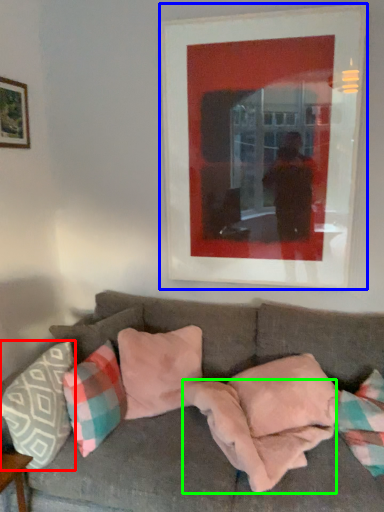
Question: Based on their relative distances, which object is nearer to pillow (highlighted by a red box)? Choose from picture frame (highlighted by a blue box) and blanket (highlighted by a green box).

Choices:
 (A) picture frame
 (B) blanket

Answer: (B)